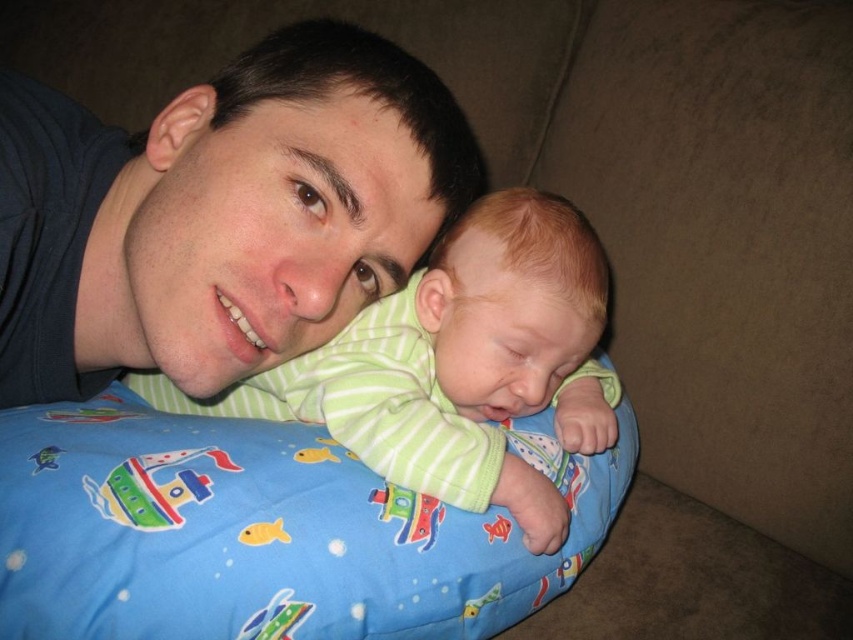
Which of these two, blue fabric bean bag at center or multicolored fabric boat at lower left, stands shorter?

multicolored fabric boat at lower left

Is point (131, 461) positioned after point (199, 468)?

That is False.

Locate an element on the screen. blue fabric bean bag at center is located at coordinates (264, 531).

Looking at this image, can you confirm if matte blue shirt at upper left is positioned above green striped shirt at center?

Yes, matte blue shirt at upper left is above green striped shirt at center.

Is point (312, 204) less distant than point (471, 385)?

Yes, it is in front of point (471, 385).

This screenshot has width=853, height=640. Find the location of `matte blue shirt at upper left`. matte blue shirt at upper left is located at coordinates (219, 212).

Does green striped shirt at center appear on the right side of multicolored fabric boat at lower left?

Correct, you'll find green striped shirt at center to the right of multicolored fabric boat at lower left.

Does green striped shirt at center come behind multicolored fabric boat at lower left?

Yes, it is.

Who is more forward, (x=397, y=372) or (x=103, y=508)?

Point (x=103, y=508)

Identify the location of green striped shirt at center. Image resolution: width=853 pixels, height=640 pixels. (476, 362).